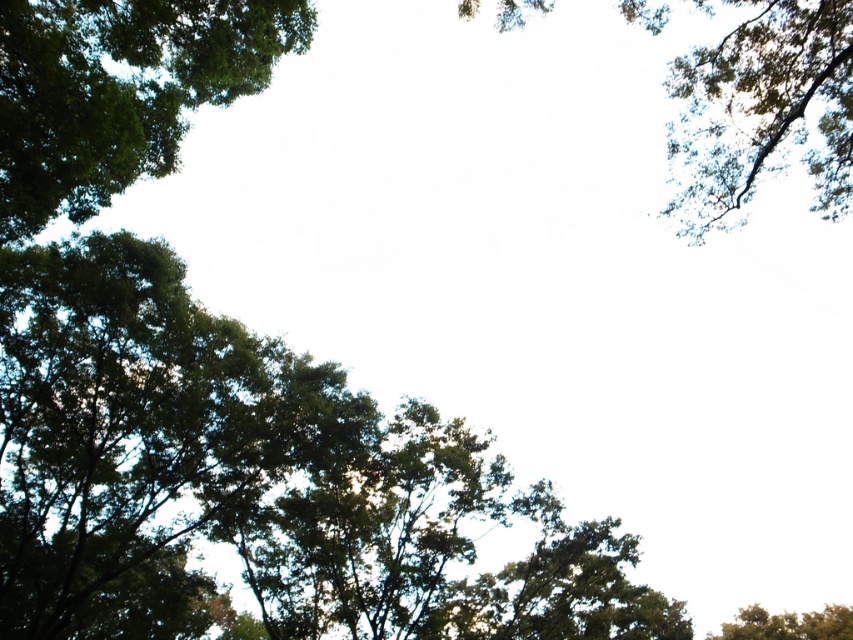
You are a bird trying to find a nesting spot. You see the green leafy tree at upper left and the green leafy tree at lower right. Which tree has a wider canopy for nesting?

The green leafy tree at upper left has a wider canopy than the green leafy tree at lower right, so it would be a better choice for nesting.

You are standing under a tree canopy and looking up. You see a green leafy tree at left and a green leafy tree at lower right. Which tree is positioned more to the west if the sun is setting in the west?

The green leafy tree at left is positioned more to the west because it is to the left of the green leafy tree at lower right, and the sun is setting in the west.

You are standing under the trees looking up. Which tree, the green leafy tree at upper left or the green leafy tree at upper right, would appear closer to you based on their height?

The green leafy tree at upper left is much taller than the green leafy tree at upper right. Since taller objects can sometimes appear closer when viewed from below, the green leafy tree at upper left might appear closer to you.